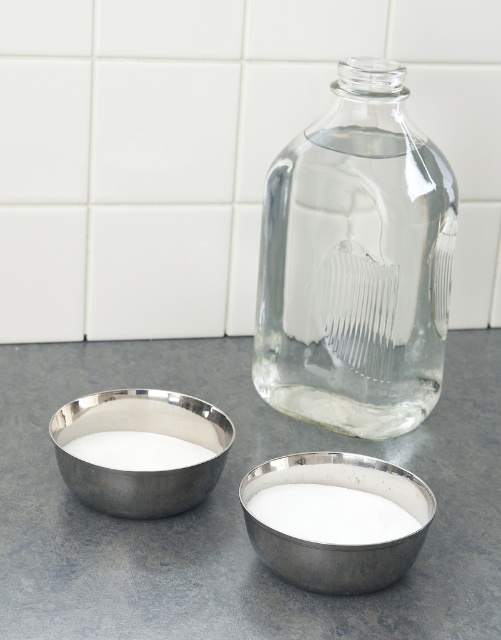
Question: Does metallic bowls at center have a smaller size compared to white powder at lower left?

Choices:
 (A) no
 (B) yes

Answer: (A)

Question: Estimate the real-world distances between objects in this image. Which object is farther from the silver metallic bowl at lower center?

Choices:
 (A) clear glass jar at center
 (B) metallic bowls at center
 (C) silver metallic bowl at lower left

Answer: (A)

Question: Is white powdery substance at lower center bigger than white powder at lower left?

Choices:
 (A) no
 (B) yes

Answer: (B)

Question: In this image, where is metallic bowls at center located relative to white powdery substance at lower center?

Choices:
 (A) below
 (B) above

Answer: (B)

Question: Which point is closer to the camera taking this photo?

Choices:
 (A) (411, 547)
 (B) (41, 618)
 (C) (104, 476)
 (D) (339, 426)

Answer: (B)

Question: Which point is closer to the camera?

Choices:
 (A) silver metallic bowl at lower center
 (B) metallic bowls at center
 (C) silver metallic bowl at lower left

Answer: (B)